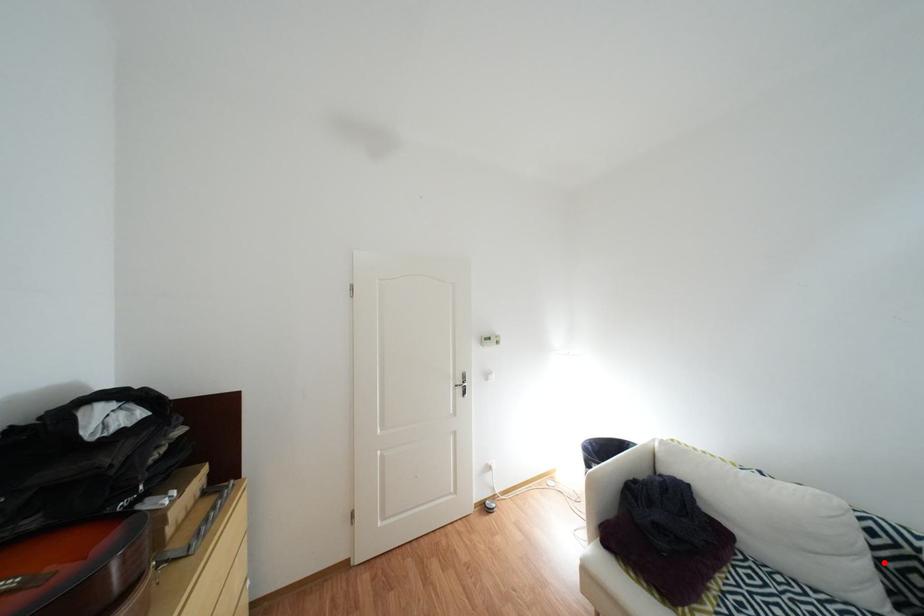
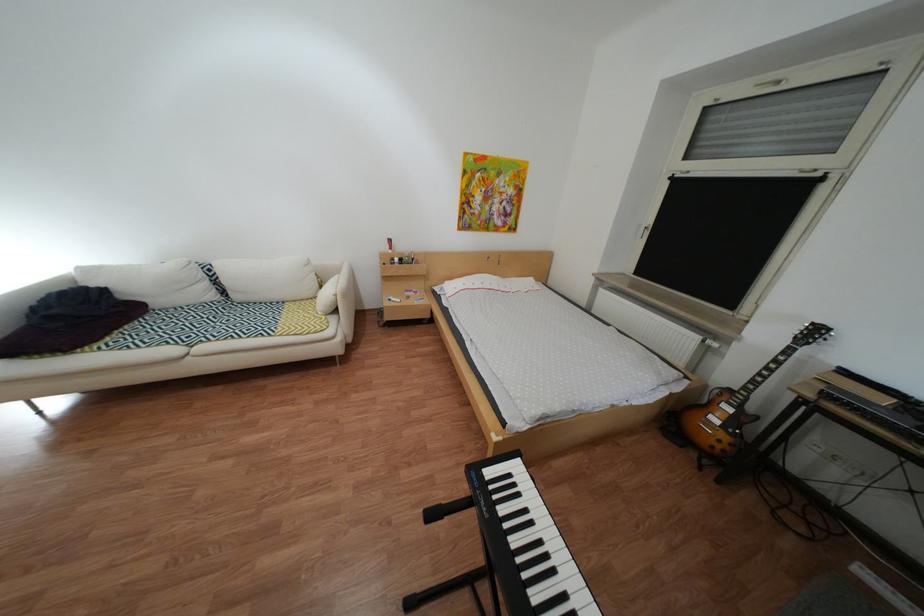
Locate, in the second image, the point that corresponds to the highlighted location in the first image.

(223, 284)